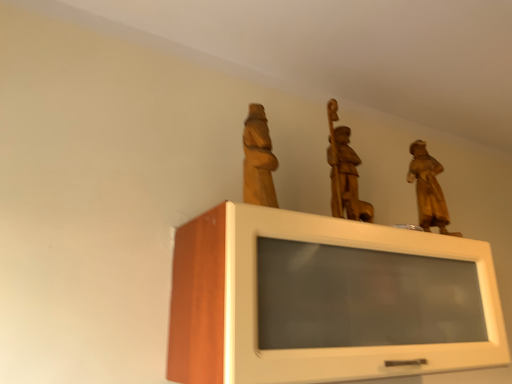
Question: In terms of width, does wooden statue at center, which is the 2th sculpture in left-to-right order, look wider or thinner when compared to wooden statue at upper right, arranged as the first sculpture when viewed from the right?

Choices:
 (A) wide
 (B) thin

Answer: (A)

Question: Considering the relative positions of wooden statue at center, which is the 2th sculpture in left-to-right order, and wooden statue at upper right, the third sculpture positioned from the left, in the image provided, is wooden statue at center, which is the 2th sculpture in left-to-right order, to the left or to the right of wooden statue at upper right, the third sculpture positioned from the left,?

Choices:
 (A) right
 (B) left

Answer: (B)

Question: Considering the real-world distances, which object is closest to the wooden statue at center, arranged as the 2th sculpture when viewed from the right?

Choices:
 (A) white glossy cabinet at upper center
 (B) wooden statue at upper right, arranged as the first sculpture when viewed from the right
 (C) wooden statue at upper center, the 3th sculpture in the right-to-left sequence

Answer: (B)

Question: Which object is positioned farthest from the wooden statue at center, arranged as the 2th sculpture when viewed from the right?

Choices:
 (A) wooden statue at upper center, the 3th sculpture in the right-to-left sequence
 (B) wooden statue at upper right, arranged as the first sculpture when viewed from the right
 (C) white glossy cabinet at upper center

Answer: (C)